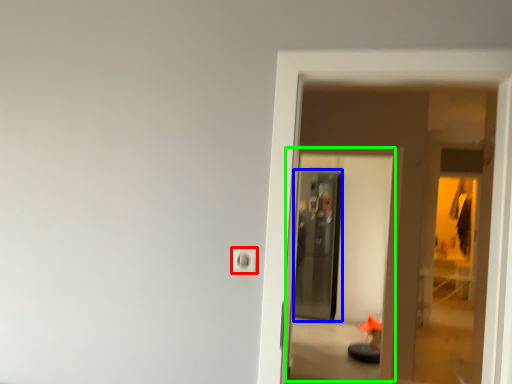
Question: Based on their relative distances, which object is nearer to electric outlet (highlighted by a red box)? Choose from screen door (highlighted by a blue box) and screen door (highlighted by a green box).

Choices:
 (A) screen door
 (B) screen door

Answer: (B)